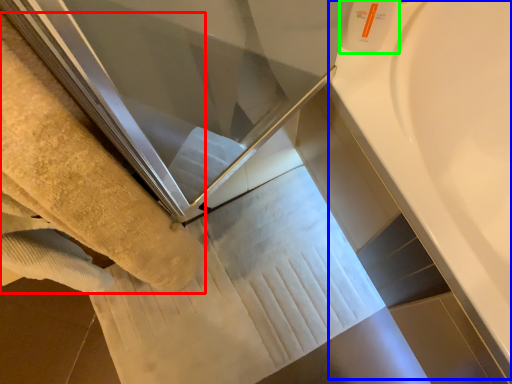
Question: Which object is positioned closest to towel (highlighted by a red box)? Select from bath (highlighted by a blue box) and toiletry (highlighted by a green box).

Choices:
 (A) bath
 (B) toiletry

Answer: (B)